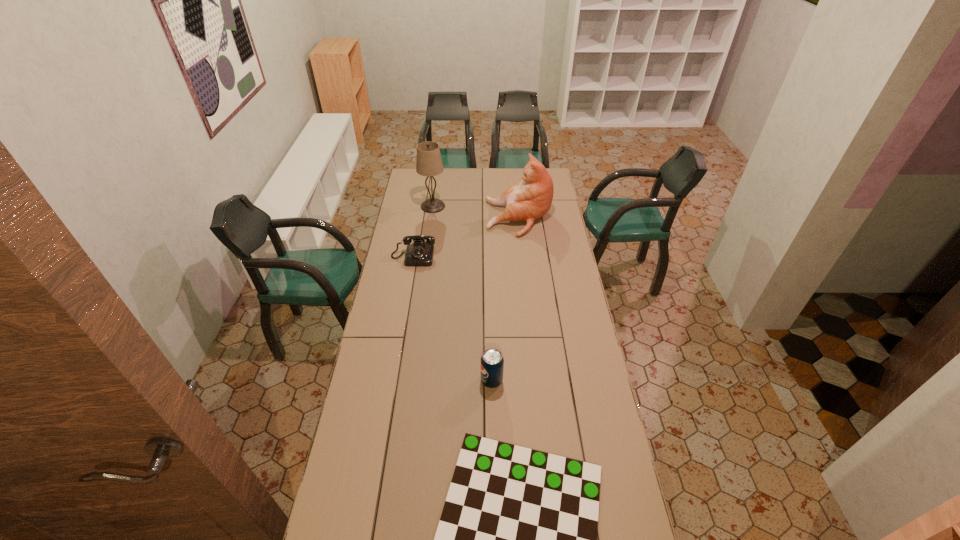
The height and width of the screenshot is (540, 960). What are the coordinates of `free space between the third tallest object and the second shortest object` in the screenshot? It's located at (452, 319).

The width and height of the screenshot is (960, 540). In order to click on empty space between the second nearest object and the cat in this screenshot , I will do `click(505, 299)`.

This screenshot has height=540, width=960. I want to click on vacant space in between the cat and the third shortest object, so click(505, 299).

This screenshot has width=960, height=540. In order to click on unoccupied area between the second shortest object and the cat in this screenshot , I will do `click(466, 238)`.

Locate an element on the screen. object that stands as the second closest to the third farthest object is located at coordinates (429, 163).

Select which object appears as the closest to the cat. Please provide its 2D coordinates. Your answer should be formatted as a tuple, i.e. [(x, y)], where the tuple contains the x and y coordinates of a point satisfying the conditions above.

[(429, 163)]

The height and width of the screenshot is (540, 960). I want to click on vacant area that satisfies the following two spatial constraints: 1. on the dial of the telephone; 2. on the left side of the soda can, so click(x=393, y=381).

Locate an element on the screen. The height and width of the screenshot is (540, 960). vacant space that satisfies the following two spatial constraints: 1. on the face of the cat; 2. on the dial of the fourth tallest object is located at coordinates (523, 257).

Find the location of `vacant position in the image that satisfies the following two spatial constraints: 1. on the front-facing side of the lampshade; 2. on the right side of the soda can`. vacant position in the image that satisfies the following two spatial constraints: 1. on the front-facing side of the lampshade; 2. on the right side of the soda can is located at coordinates click(409, 381).